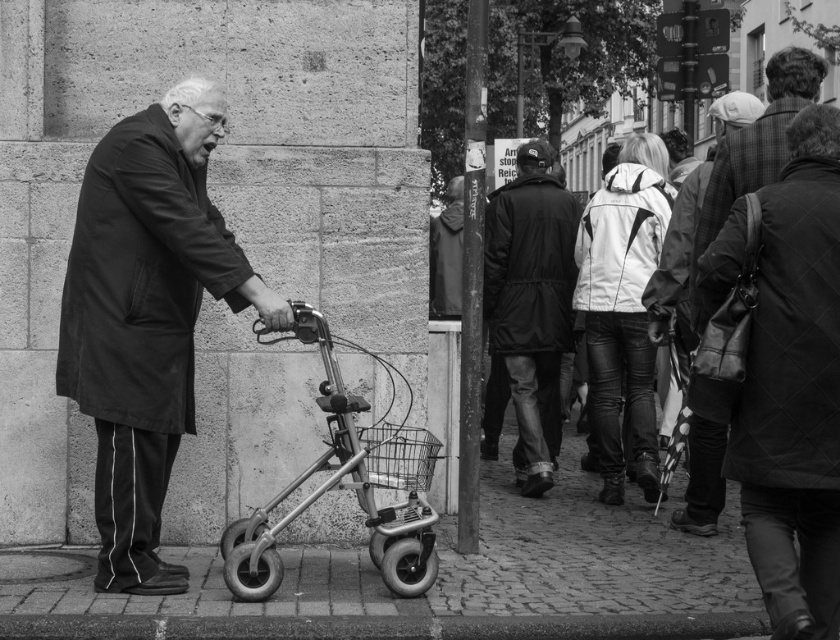
Which is behind, point (189, 356) or point (696, 490)?

The point (696, 490) is more distant.

Is dark coat at left wider than leather jacket at center?

Yes.

Which is behind, point (156, 532) or point (686, 524)?

The point (686, 524) is behind.

This screenshot has height=640, width=840. Find the location of `dark coat at left`. dark coat at left is located at coordinates (147, 316).

Is dark coat at left bigger than dark gray fabric coat at center?

Yes.

Is dark coat at left to the right of dark gray fabric coat at center from the viewer's perspective?

In fact, dark coat at left is to the left of dark gray fabric coat at center.

Measure the distance between point (x=108, y=273) and camera.

Point (x=108, y=273) and camera are 6.43 meters apart.

The height and width of the screenshot is (640, 840). What are the coordinates of `dark coat at left` in the screenshot? It's located at (147, 316).

Does dark coat at left appear under metallic walker at center?

No, dark coat at left is not below metallic walker at center.

Is point (106, 246) positioned in front of point (318, 321)?

No, it is not.

This screenshot has width=840, height=640. Identify the location of dark coat at left. (147, 316).